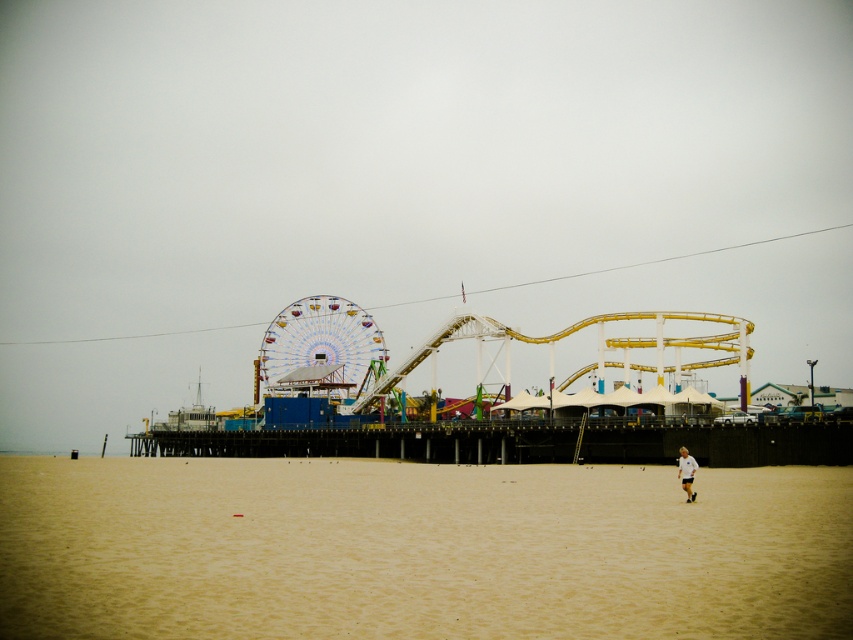
You are standing on the beige sand at lower center and want to reach the white and blue striped ferris wheel at center. Which direction should you move to get there?

You should move upward from the beige sand at lower center to reach the white and blue striped ferris wheel at center since the sand is below the Ferris wheel.

You are standing on the beach and want to walk towards the white and blue striped ferris wheel at center. Which direction should you walk from the beige sand at lower center?

You should walk to the left from the beige sand at lower center because it is to the right of the white and blue striped ferris wheel at center.